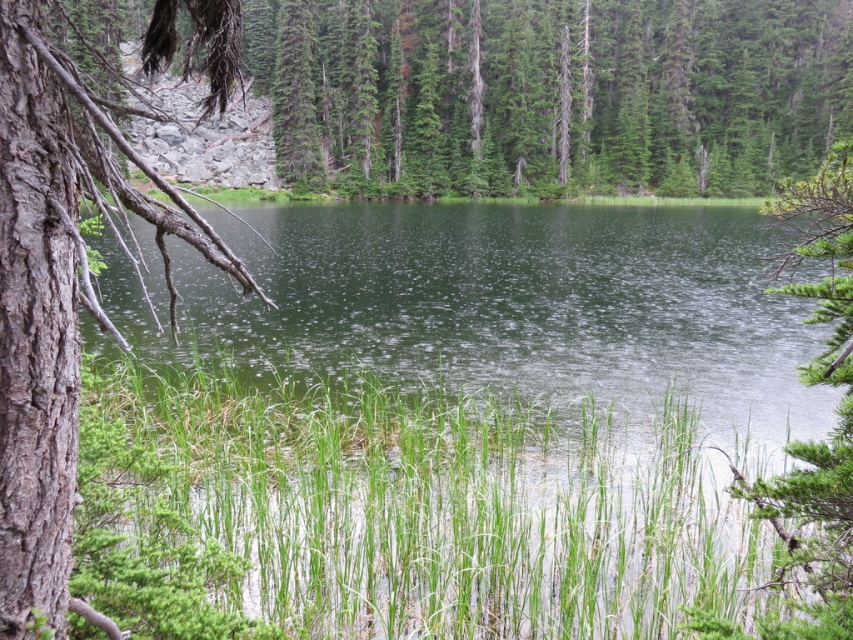
Does green textured tree at upper center come behind smooth bark tree at left?

Yes, green textured tree at upper center is further from the viewer.

Find the location of a particular element. green textured tree at upper center is located at coordinates (553, 92).